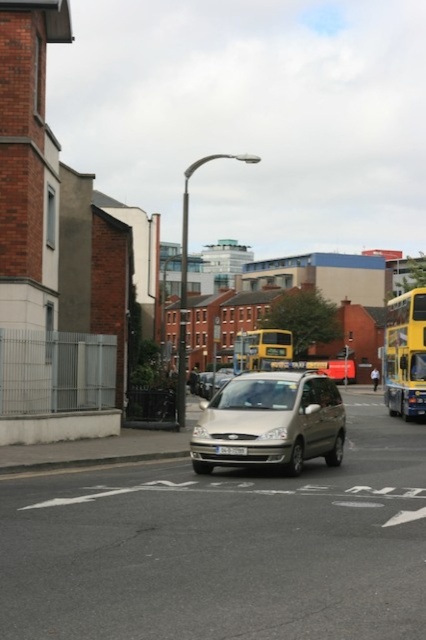
Question: Which object is closer to the camera taking this photo?

Choices:
 (A) white plastic license plate at center
 (B) yellow metallic bus at center
 (C) satin gold minivan at center
 (D) yellow metallic bus at right

Answer: (C)

Question: Is satin gold minivan at center further to camera compared to yellow metallic bus at center?

Choices:
 (A) no
 (B) yes

Answer: (A)

Question: Which point is farther to the camera?

Choices:
 (A) yellow metallic bus at center
 (B) yellow metallic bus at right
 (C) white plastic license plate at center
 (D) satin gold minivan at center

Answer: (A)

Question: Is satin gold minivan at center smaller than white plastic license plate at center?

Choices:
 (A) no
 (B) yes

Answer: (A)

Question: Is yellow metallic bus at center to the left of white plastic license plate at center from the viewer's perspective?

Choices:
 (A) yes
 (B) no

Answer: (B)

Question: Which object is the farthest from the satin gold minivan at center?

Choices:
 (A) yellow metallic bus at center
 (B) yellow metallic bus at right
 (C) white plastic license plate at center

Answer: (A)